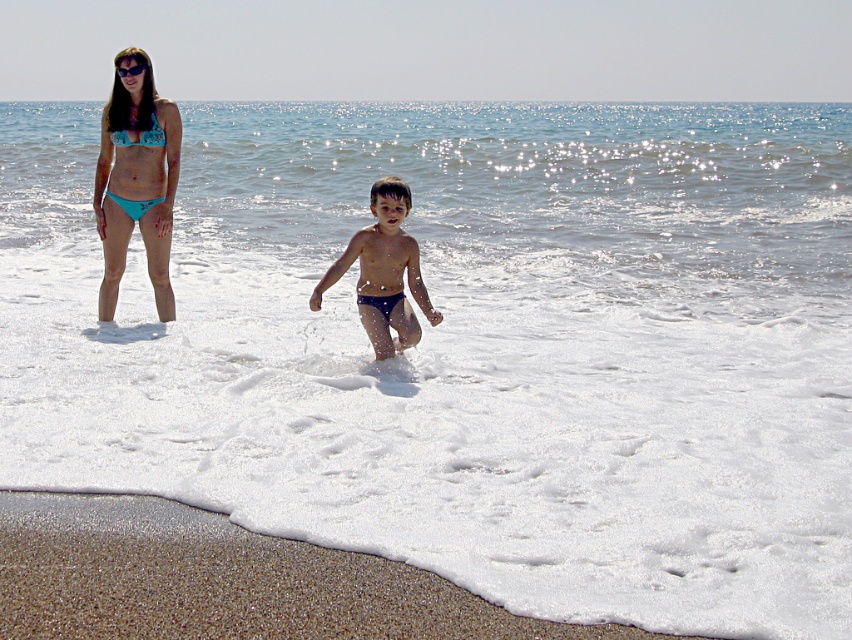
Question: Can you confirm if blue textured shorts at center is positioned above blue fabric bikini at upper left?

Choices:
 (A) no
 (B) yes

Answer: (A)

Question: Which point is closer to the camera taking this photo?

Choices:
 (A) (373, 593)
 (B) (417, 244)

Answer: (A)

Question: Is blue textured shorts at center further to the viewer compared to black plastic goggles at upper center?

Choices:
 (A) no
 (B) yes

Answer: (A)

Question: Estimate the real-world distances between objects in this image. Which object is farther from the blue textured shorts at center?

Choices:
 (A) teal bikini at upper left
 (B) black plastic goggles at upper center

Answer: (B)

Question: Is teal bikini at upper left below blue fabric bikini at upper left?

Choices:
 (A) no
 (B) yes

Answer: (B)

Question: Which of the following is the closest to the observer?

Choices:
 (A) blue textured shorts at center
 (B) brown sandy beach at lower left

Answer: (B)